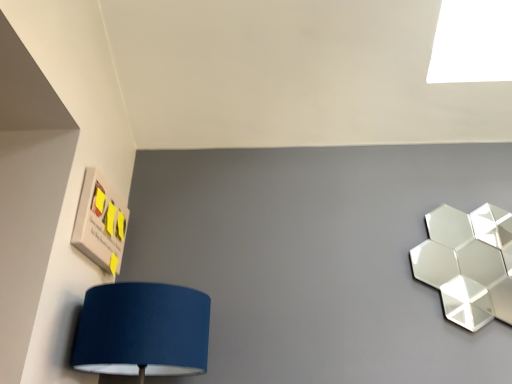
Question: From the image's perspective, does matte wood sign with sticky notes at upper left appear lower than shiny metallic hexagonal at upper right?

Choices:
 (A) yes
 (B) no

Answer: (B)

Question: From the image's perspective, is matte wood sign with sticky notes at upper left on shiny metallic hexagonal at upper right?

Choices:
 (A) no
 (B) yes

Answer: (B)

Question: Can you confirm if matte wood sign with sticky notes at upper left is positioned to the right of shiny metallic hexagonal at upper right?

Choices:
 (A) no
 (B) yes

Answer: (A)

Question: Can you confirm if matte wood sign with sticky notes at upper left is wider than shiny metallic hexagonal at upper right?

Choices:
 (A) no
 (B) yes

Answer: (A)

Question: Is shiny metallic hexagonal at upper right completely or partially inside matte wood sign with sticky notes at upper left?

Choices:
 (A) yes
 (B) no

Answer: (B)

Question: From a real-world perspective, relative to white glossy light at upper right, is matte wood sign with sticky notes at upper left vertically above or below?

Choices:
 (A) below
 (B) above

Answer: (A)

Question: Is matte wood sign with sticky notes at upper left bigger or smaller than white glossy light at upper right?

Choices:
 (A) big
 (B) small

Answer: (B)

Question: Is matte wood sign with sticky notes at upper left in front of or behind white glossy light at upper right in the image?

Choices:
 (A) behind
 (B) front

Answer: (B)

Question: Considering the positions of point pos(99,200) and point pos(437,31), is point pos(99,200) closer or farther from the camera than point pos(437,31)?

Choices:
 (A) farther
 (B) closer

Answer: (B)

Question: Is white glossy light at upper right inside or outside of matte wood sign with sticky notes at upper left?

Choices:
 (A) outside
 (B) inside

Answer: (A)

Question: From a real-world perspective, relative to matte wood sign with sticky notes at upper left, is white glossy light at upper right vertically above or below?

Choices:
 (A) below
 (B) above

Answer: (B)

Question: Does point (452, 14) appear closer or farther from the camera than point (77, 233)?

Choices:
 (A) farther
 (B) closer

Answer: (A)

Question: Is white glossy light at upper right taller or shorter than matte wood sign with sticky notes at upper left?

Choices:
 (A) tall
 (B) short

Answer: (A)

Question: In the image, is white glossy light at upper right positioned in front of or behind shiny metallic hexagonal at upper right?

Choices:
 (A) behind
 (B) front

Answer: (A)

Question: In terms of width, does white glossy light at upper right look wider or thinner when compared to shiny metallic hexagonal at upper right?

Choices:
 (A) thin
 (B) wide

Answer: (B)